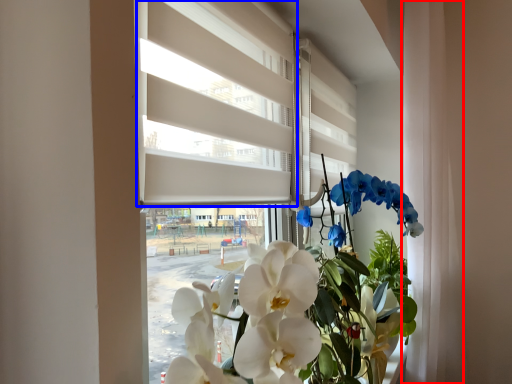
Question: Which of the following is the farthest to the observer, curtain (highlighted by a red box) or blind (highlighted by a blue box)?

Choices:
 (A) curtain
 (B) blind

Answer: (A)